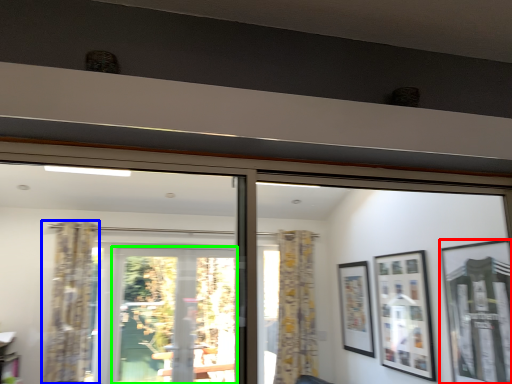
Question: Which object is the farthest from picture frame (highlighted by a red box)? Choose among these: curtain (highlighted by a blue box) or screen door (highlighted by a green box).

Choices:
 (A) curtain
 (B) screen door

Answer: (A)